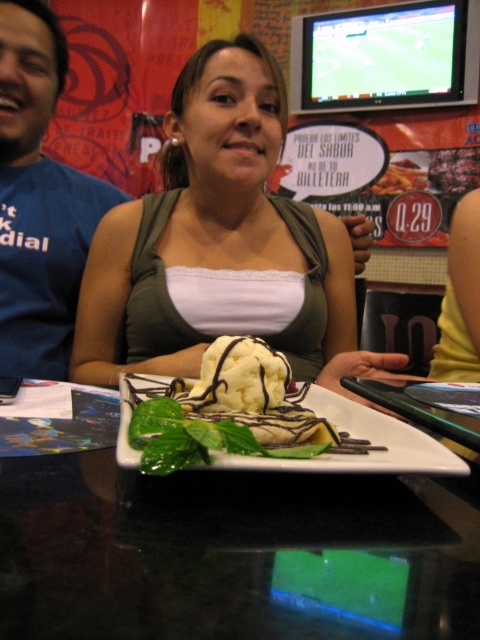
You are a food photographer and need to capture the dessert in the image. You want to highlight the white creamy ice cream at center and the yellow creamy ice cream at center. Which one should you focus on first if you want to start with the one closer to the camera?

The white creamy ice cream at center is below the yellow creamy ice cream at center, so it is farther away from the camera. Therefore, you should focus on the yellow creamy ice cream at center first since it is closer.

You are a photographer setting up for a group photo. You notice the blue fabric shirt at left and the white creamy ice cream at center. Which object is taller in the image?

The blue fabric shirt at left is taller than the white creamy ice cream at center.

You are a waiter in a restaurant and you need to place a new order at the table. The customer is sitting at the table with the woman in the green cardigan. Where should you place the new order relative to the point at coordinates point (38, 200)?

The point at coordinates point (38, 200) is located on the blue fabric shirt at left, so you should place the new order on the table in front of the customer, not on the shirt.